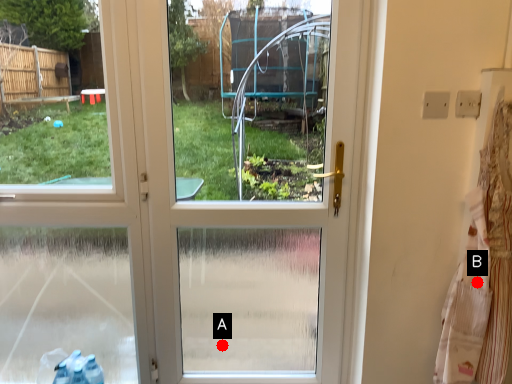
Question: Two points are circled on the image, labeled by A and B beside each circle. Which point is farther from the camera taking this photo?

Choices:
 (A) A is further
 (B) B is further

Answer: (A)